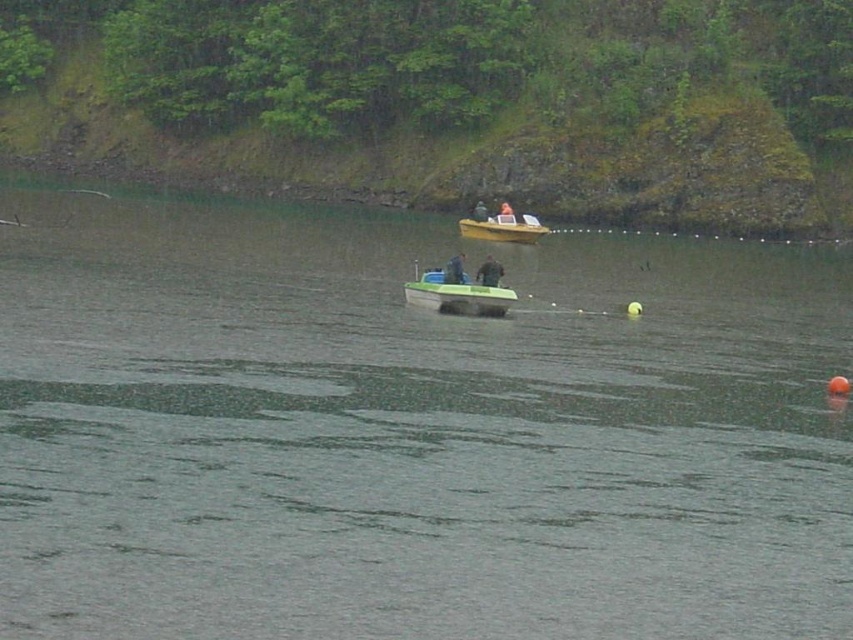
Is point (444, 275) positioned in front of point (474, 202)?

Yes, it is.

Image resolution: width=853 pixels, height=640 pixels. I want to click on dark green fabric jacket at center, so click(x=454, y=269).

Locate an element on the screen. The width and height of the screenshot is (853, 640). dark green fabric jacket at center is located at coordinates (454, 269).

Who is more forward, (485, 276) or (511, 220)?

Point (485, 276) is more forward.

Is dark gray fabric jacket at center shorter than smooth skin face at center?

Yes, dark gray fabric jacket at center is shorter than smooth skin face at center.

Locate an element on the screen. The width and height of the screenshot is (853, 640). dark gray fabric jacket at center is located at coordinates (489, 273).

Where is `dark gray fabric jacket at center`? This screenshot has height=640, width=853. dark gray fabric jacket at center is located at coordinates (489, 273).

Does green plastic boat at center come in front of dark green fabric jacket at center?

Yes, it is in front of dark green fabric jacket at center.

The height and width of the screenshot is (640, 853). What do you see at coordinates (457, 292) in the screenshot?
I see `green plastic boat at center` at bounding box center [457, 292].

Is point (405, 292) positioned after point (450, 276)?

Yes.

This screenshot has height=640, width=853. In order to click on green plastic boat at center in this screenshot , I will do `click(457, 292)`.